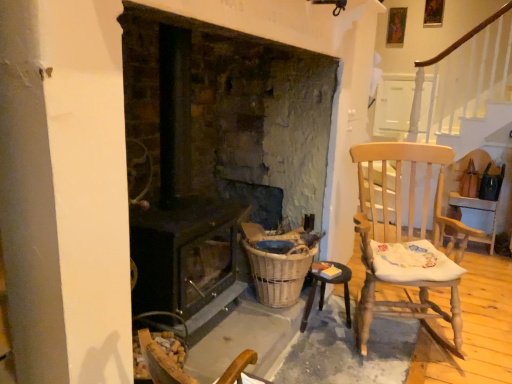
Question: Are dark brown wood stove at center and wooden table at lower right located far from each other?

Choices:
 (A) yes
 (B) no

Answer: (B)

Question: Considering the relative sizes of dark brown wood stove at center and wooden table at lower right in the image provided, is dark brown wood stove at center wider than wooden table at lower right?

Choices:
 (A) yes
 (B) no

Answer: (A)

Question: Considering the relative sizes of dark brown wood stove at center and wooden table at lower right in the image provided, is dark brown wood stove at center smaller than wooden table at lower right?

Choices:
 (A) no
 (B) yes

Answer: (A)

Question: Considering the relative sizes of dark brown wood stove at center and wooden table at lower right in the image provided, is dark brown wood stove at center shorter than wooden table at lower right?

Choices:
 (A) yes
 (B) no

Answer: (B)

Question: Is dark brown wood stove at center at the right side of wooden table at lower right?

Choices:
 (A) no
 (B) yes

Answer: (A)

Question: Considering their positions, is dark brown wood stove at center located in front of or behind light wood rocking chair at right?

Choices:
 (A) front
 (B) behind

Answer: (A)

Question: Considering the positions of dark brown wood stove at center and light wood rocking chair at right in the image, is dark brown wood stove at center wider or thinner than light wood rocking chair at right?

Choices:
 (A) thin
 (B) wide

Answer: (A)

Question: From the image's perspective, is dark brown wood stove at center located above or below light wood rocking chair at right?

Choices:
 (A) above
 (B) below

Answer: (A)

Question: From a real-world perspective, is dark brown wood stove at center above or below light wood rocking chair at right?

Choices:
 (A) below
 (B) above

Answer: (B)

Question: Considering their positions, is dark brown wood stove at center located in front of or behind woven brown basket at lower center?

Choices:
 (A) front
 (B) behind

Answer: (A)

Question: Based on their sizes in the image, would you say dark brown wood stove at center is bigger or smaller than woven brown basket at lower center?

Choices:
 (A) big
 (B) small

Answer: (A)

Question: Is dark brown wood stove at center to the left or to the right of woven brown basket at lower center in the image?

Choices:
 (A) left
 (B) right

Answer: (A)

Question: Considering the positions of dark brown wood stove at center and woven brown basket at lower center in the image, is dark brown wood stove at center taller or shorter than woven brown basket at lower center?

Choices:
 (A) short
 (B) tall

Answer: (B)

Question: From the image's perspective, is light wood rocking chair at right above or below dark brown wood stove at center?

Choices:
 (A) below
 (B) above

Answer: (A)

Question: Considering the positions of point (381, 276) and point (261, 69), is point (381, 276) closer or farther from the camera than point (261, 69)?

Choices:
 (A) closer
 (B) farther

Answer: (A)